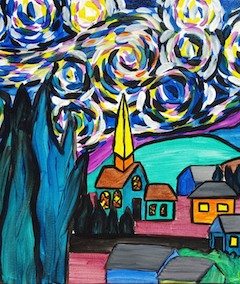
Identify the location of painting. The image size is (240, 284). (81, 238).